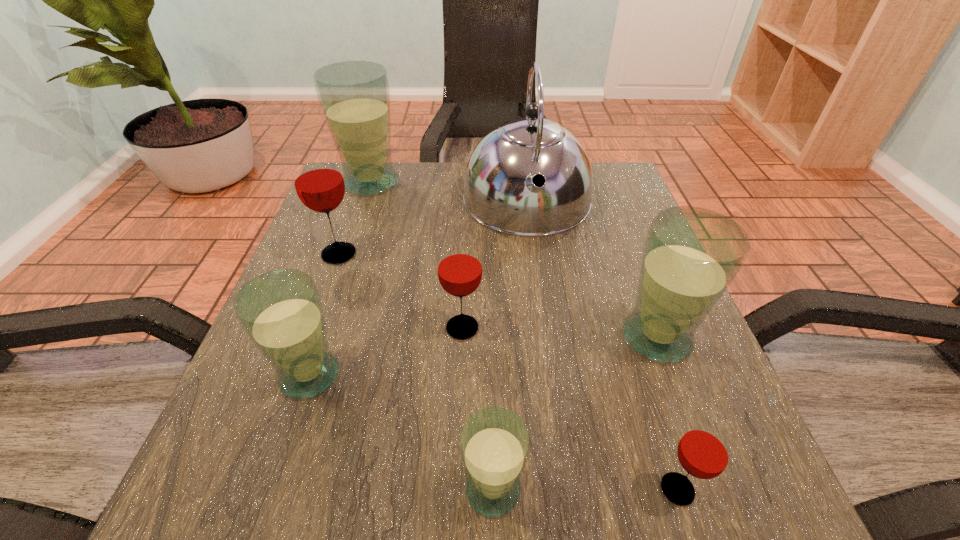
Where is `the nearest red glass`? The image size is (960, 540). the nearest red glass is located at coordinates (705, 450).

Image resolution: width=960 pixels, height=540 pixels. I want to click on the third blue glass from left to right, so click(494, 442).

Identify the location of the smallest blue glass. The height and width of the screenshot is (540, 960). (494, 442).

Image resolution: width=960 pixels, height=540 pixels. In order to click on vacant space positioned 0.260m from the spout of the kettle in this screenshot , I will do `click(547, 344)`.

Find the location of a particular element. Image resolution: width=960 pixels, height=540 pixels. free space located on the right of the biggest blue glass is located at coordinates (473, 183).

At what (x,y) coordinates should I click in order to perform the action: click on free space located 0.180m on the back of the leftmost red glass. Please return your answer as a coordinate pair (x, y). The width and height of the screenshot is (960, 540). Looking at the image, I should click on pyautogui.click(x=360, y=195).

Identify the location of vacant space positioned 0.300m on the left of the third smallest blue glass. (442, 338).

Locate an element on the screen. free location located 0.340m on the right of the second farthest red glass is located at coordinates (678, 328).

The image size is (960, 540). I want to click on free space located on the right of the third biggest blue glass, so click(x=388, y=375).

The width and height of the screenshot is (960, 540). Find the location of `vacant space located on the left of the smallest red glass`. vacant space located on the left of the smallest red glass is located at coordinates (393, 489).